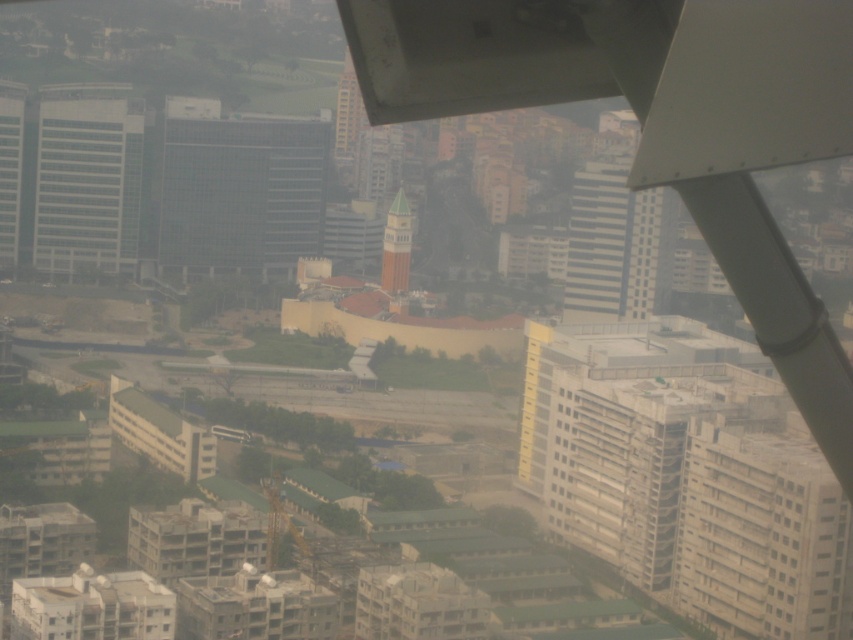
Question: Can you confirm if yellow matte building at center is thinner than green painted tower at center?

Choices:
 (A) yes
 (B) no

Answer: (B)

Question: Among these objects, which one is farthest from the camera?

Choices:
 (A) transparent glass building at center
 (B) yellow matte building at center

Answer: (A)

Question: Can you confirm if yellow matte building at center is smaller than glassy reflective skyscraper at left?

Choices:
 (A) yes
 (B) no

Answer: (B)

Question: Which of the following is the closest to the observer?

Choices:
 (A) (13, 176)
 (B) (88, 100)
 (C) (276, 147)

Answer: (C)

Question: Which point appears farthest from the camera in this image?

Choices:
 (A) (0, 84)
 (B) (399, 234)
 (C) (680, 593)

Answer: (A)

Question: Does yellow matte building at center have a lesser width compared to glassy reflective skyscraper at left?

Choices:
 (A) no
 (B) yes

Answer: (A)